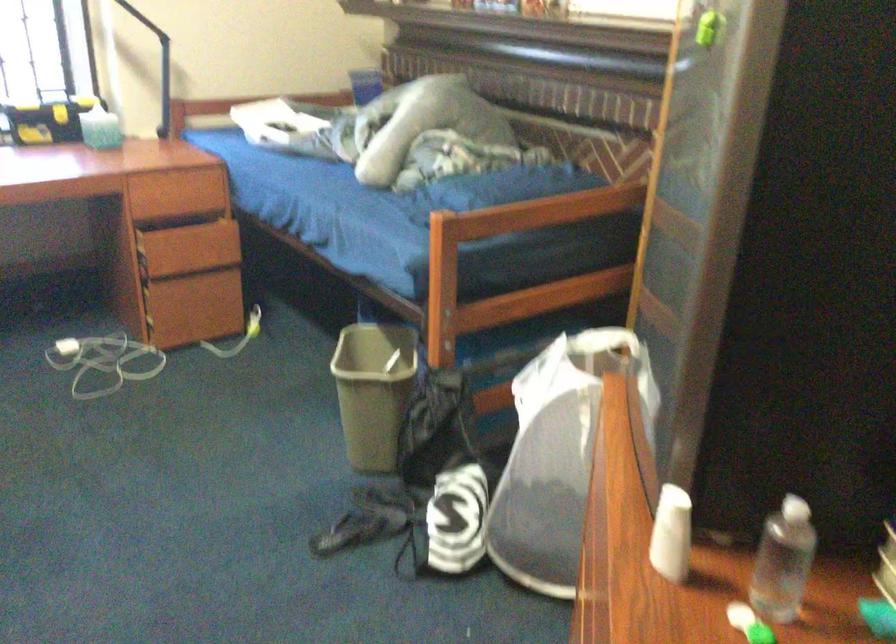
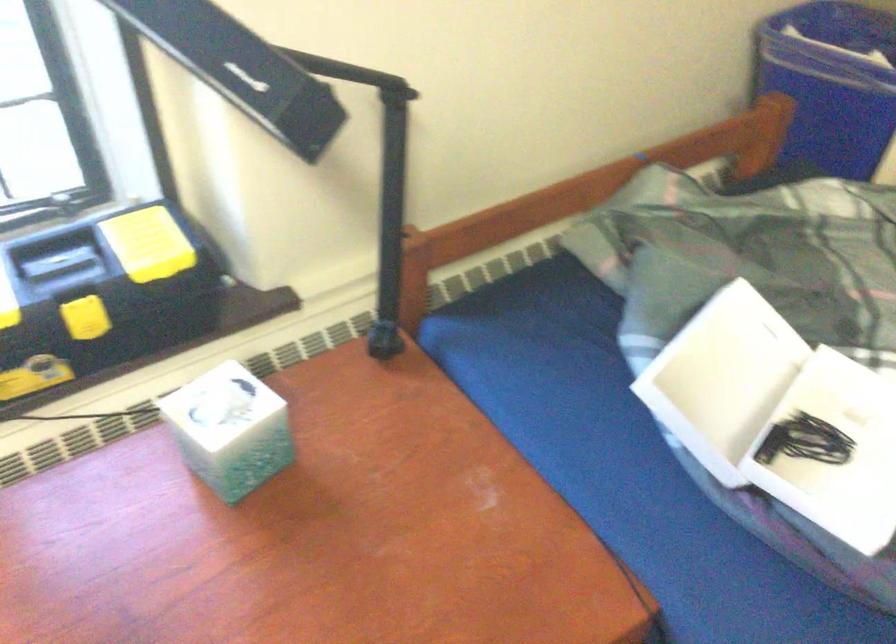
The images are taken continuously from a first-person perspective. In which direction are you moving?

The cameraman moved toward left, forward.